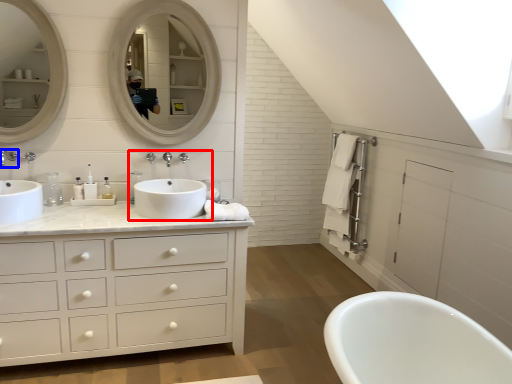
Question: Which of the following is the farthest to the observer, sink (highlighted by a red box) or tap (highlighted by a blue box)?

Choices:
 (A) sink
 (B) tap

Answer: (B)